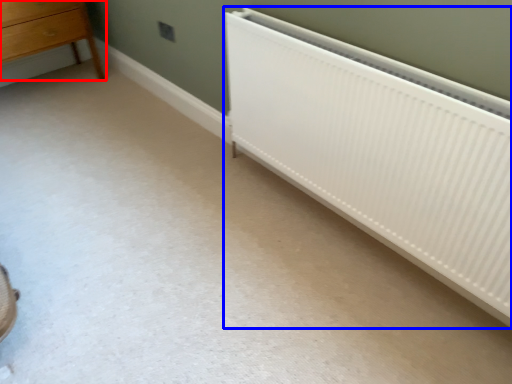
Question: Which point is closer to the camera, chest of drawers (highlighted by a red box) or radiator (highlighted by a blue box)?

Choices:
 (A) chest of drawers
 (B) radiator

Answer: (B)